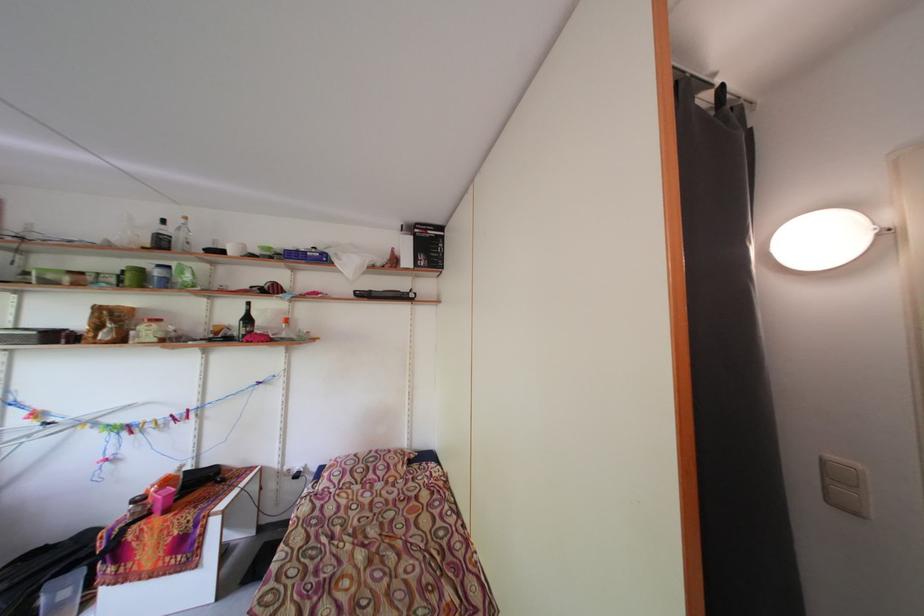
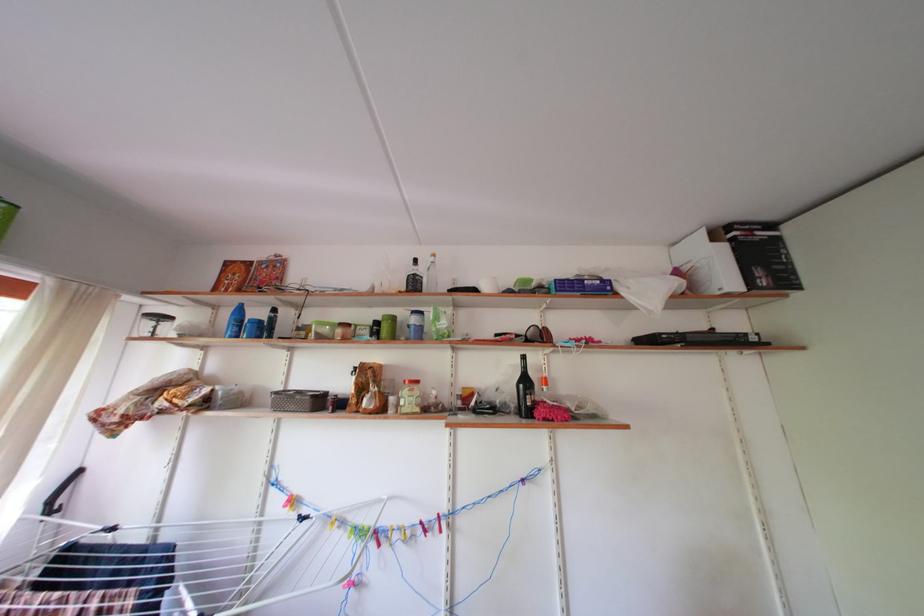
Find the pixel in the second image that matches pixel 256 325 in the first image.

(533, 387)